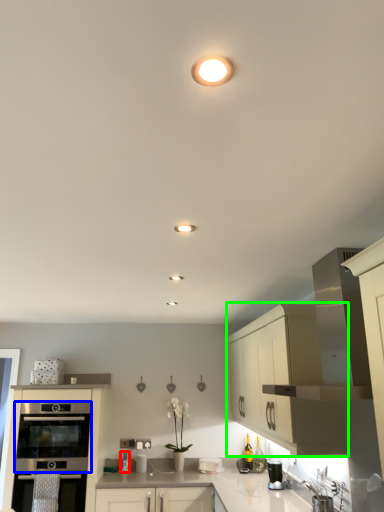
Question: Which is nearer to the appliance (highlighted by a red box)? oven (highlighted by a blue box) or cabinetry (highlighted by a green box).

Choices:
 (A) oven
 (B) cabinetry

Answer: (A)